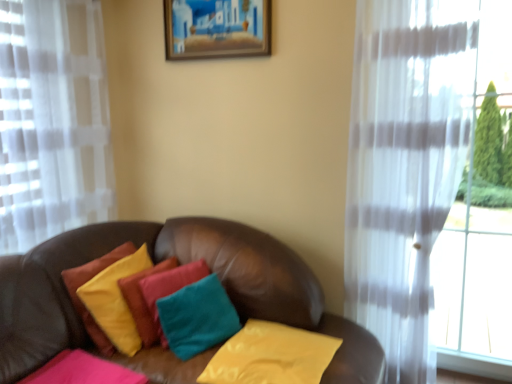
Question: Can you confirm if velvet yellow pillow at center, which is counted as the 2th pillow, starting from the left, is shorter than wooden picture frame at upper center?

Choices:
 (A) no
 (B) yes

Answer: (A)

Question: Does velvet yellow pillow at center, which is counted as the 2th pillow, starting from the left, have a larger size compared to wooden picture frame at upper center?

Choices:
 (A) no
 (B) yes

Answer: (B)

Question: Can wooden picture frame at upper center be found inside velvet yellow pillow at center, the third pillow from the right?

Choices:
 (A) no
 (B) yes

Answer: (A)

Question: From a real-world perspective, is velvet yellow pillow at center, the third pillow from the right, located higher than wooden picture frame at upper center?

Choices:
 (A) no
 (B) yes

Answer: (A)

Question: Is velvet yellow pillow at center, which is counted as the 2th pillow, starting from the left, positioned behind wooden picture frame at upper center?

Choices:
 (A) no
 (B) yes

Answer: (A)

Question: Is velvet yellow pillow at center, the third pillow from the right, positioned before wooden picture frame at upper center?

Choices:
 (A) yes
 (B) no

Answer: (A)

Question: Does pink velvety pillow at lower left, the first pillow from the left, turn towards yellow fabric pillow at center, the 4th pillow positioned from the left?

Choices:
 (A) no
 (B) yes

Answer: (A)

Question: Does pink velvety pillow at lower left, acting as the 4th pillow starting from the right, lie in front of yellow fabric pillow at center, which is the first pillow in right-to-left order?

Choices:
 (A) no
 (B) yes

Answer: (B)

Question: Can you confirm if pink velvety pillow at lower left, acting as the 4th pillow starting from the right, is bigger than yellow fabric pillow at center, which is the first pillow in right-to-left order?

Choices:
 (A) no
 (B) yes

Answer: (A)

Question: Is pink velvety pillow at lower left, the first pillow from the left, at the left side of yellow fabric pillow at center, which is the first pillow in right-to-left order?

Choices:
 (A) yes
 (B) no

Answer: (A)

Question: From a real-world perspective, is pink velvety pillow at lower left, the first pillow from the left, on top of yellow fabric pillow at center, which is the first pillow in right-to-left order?

Choices:
 (A) yes
 (B) no

Answer: (A)

Question: Can you confirm if pink velvety pillow at lower left, acting as the 4th pillow starting from the right, is wider than yellow fabric pillow at center, the 4th pillow positioned from the left?

Choices:
 (A) yes
 (B) no

Answer: (B)

Question: From a real-world perspective, is pink velvety pillow at lower left, the first pillow from the left, located beneath wooden picture frame at upper center?

Choices:
 (A) yes
 (B) no

Answer: (A)